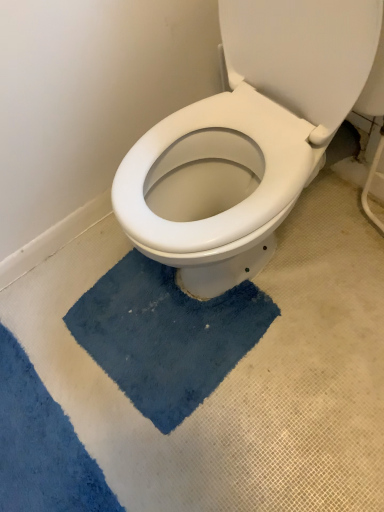
At what (x,y) coordinates should I click in order to perform the action: click on free space to the right of blue plush bath mat at center, acting as the first bath mat starting from the right. Please return your answer as a coordinate pair (x, y). This screenshot has height=512, width=384. Looking at the image, I should click on (320, 306).